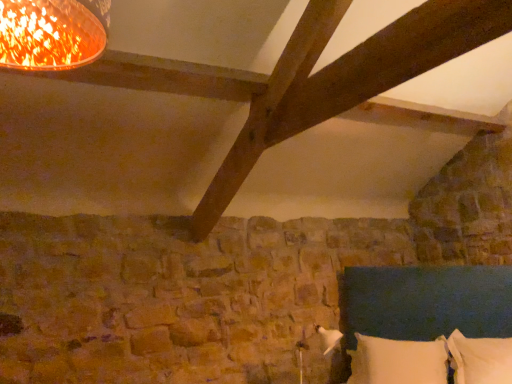
Question: From a real-world perspective, is dark blue fabric bed at lower right above or below white soft pillow at lower right, the 1th pillow viewed from the right?

Choices:
 (A) above
 (B) below

Answer: (A)

Question: In the image, is dark blue fabric bed at lower right on the left side or the right side of white soft pillow at lower right, the 1th pillow viewed from the right?

Choices:
 (A) left
 (B) right

Answer: (A)

Question: Which object is the farthest from the white soft pillow at lower right, the 1th pillow viewed from the right?

Choices:
 (A) white soft pillow at lower right, which ranks as the 1th pillow in left-to-right order
 (B) dark blue fabric bed at lower right

Answer: (B)

Question: Considering the real-world distances, which object is farthest from the dark blue fabric bed at lower right?

Choices:
 (A) white soft pillow at lower right, which ranks as the 2th pillow in right-to-left order
 (B) white soft pillow at lower right, which appears as the second pillow when viewed from the left

Answer: (B)